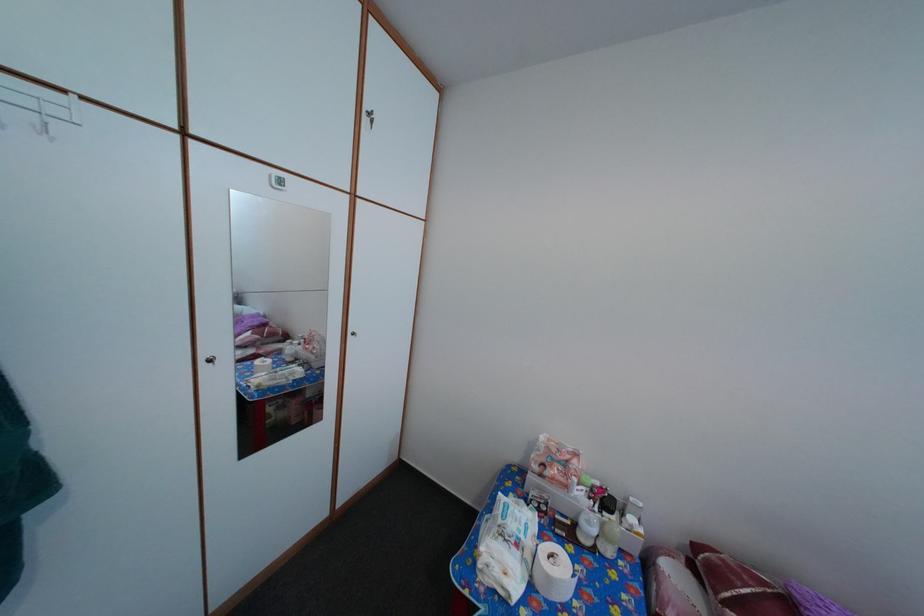
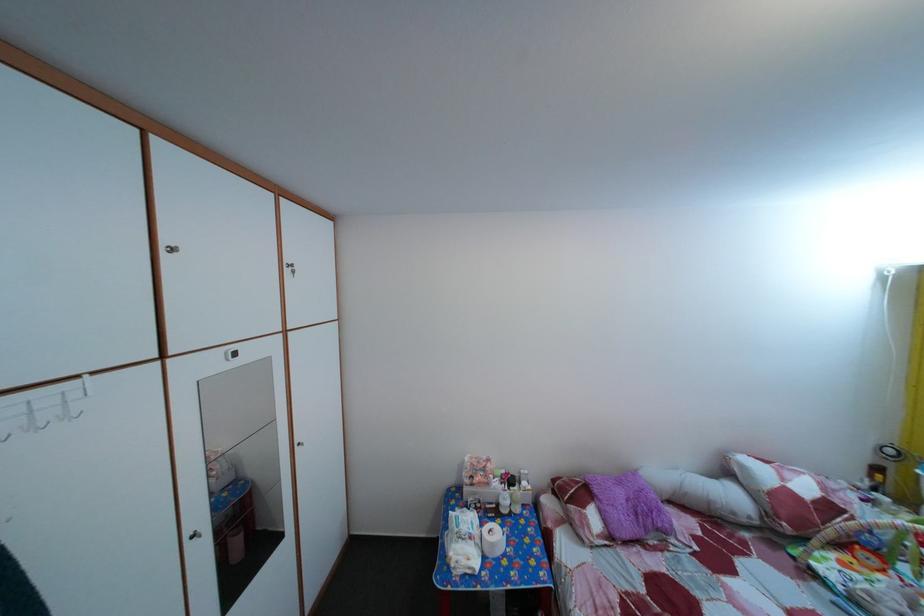
Question: The images are taken continuously from a first-person perspective. In which direction is your viewpoint rotating?

Choices:
 (A) Left
 (B) Right
 (C) Up
 (D) Down

Answer: (B)